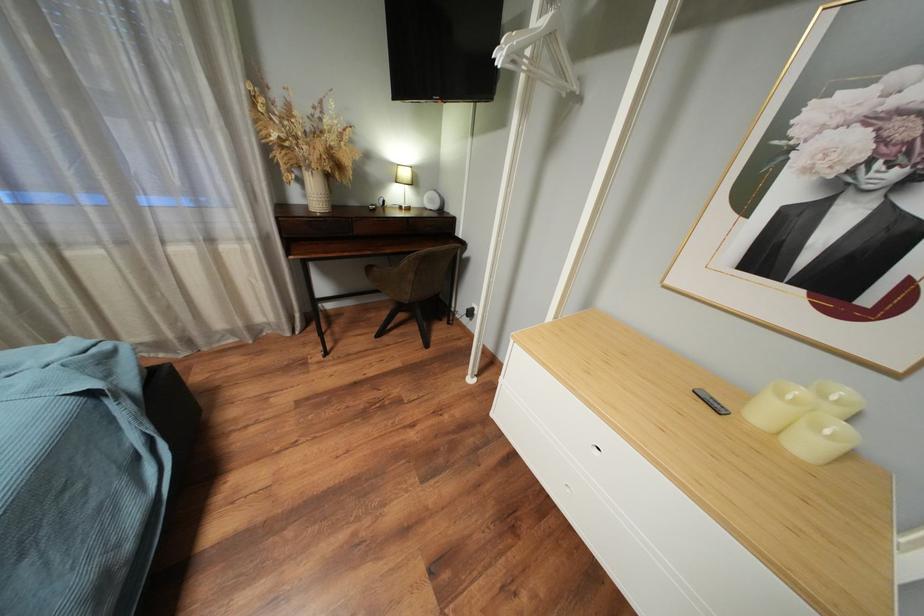
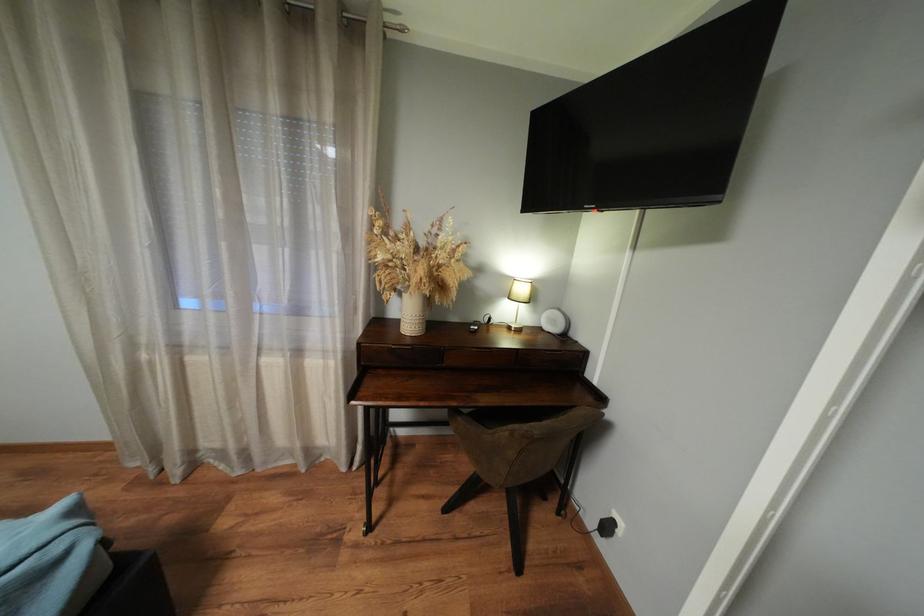
From the picture: The images are taken continuously from a first-person perspective. In which direction is your viewpoint rotating?

The rotation direction of the camera is left-up.